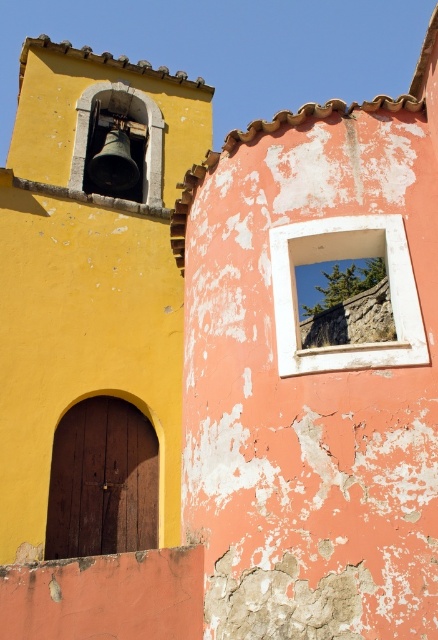
Question: Can you confirm if wooden door at lower left is thinner than metallic bell at upper left?

Choices:
 (A) no
 (B) yes

Answer: (B)

Question: Which of the following is the closest to the observer?

Choices:
 (A) (91, 90)
 (B) (282, 260)

Answer: (B)

Question: Is white wooden window at center above metallic bell at upper left?

Choices:
 (A) yes
 (B) no

Answer: (B)

Question: Which object appears farthest from the camera in this image?

Choices:
 (A) wooden door at lower left
 (B) metallic bell at upper left
 (C) white wooden window at center

Answer: (B)

Question: In this image, where is wooden door at lower left located relative to metallic bell at upper left?

Choices:
 (A) above
 (B) below

Answer: (B)

Question: Which object is the closest to the white wooden window at center?

Choices:
 (A) metallic bell at upper left
 (B) wooden door at lower left

Answer: (B)